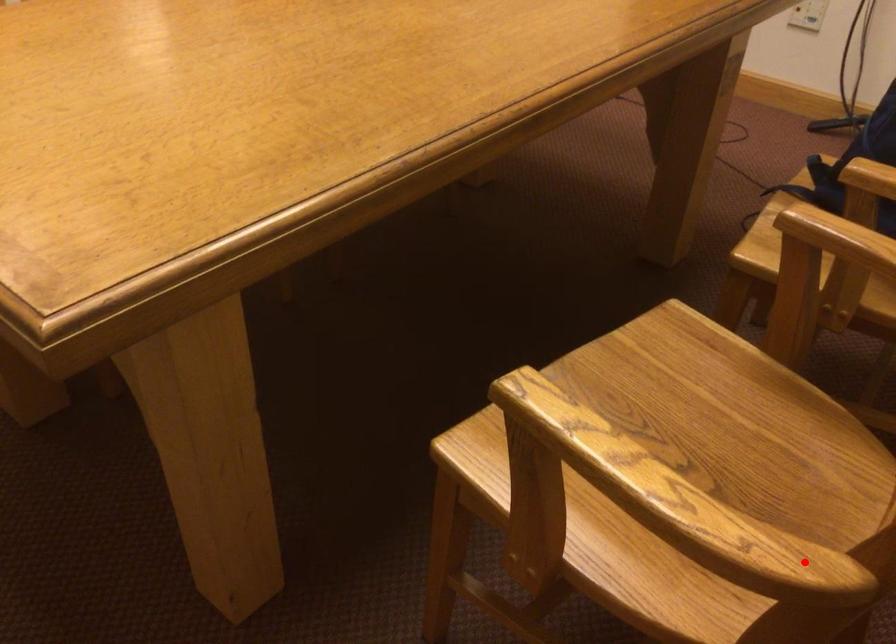
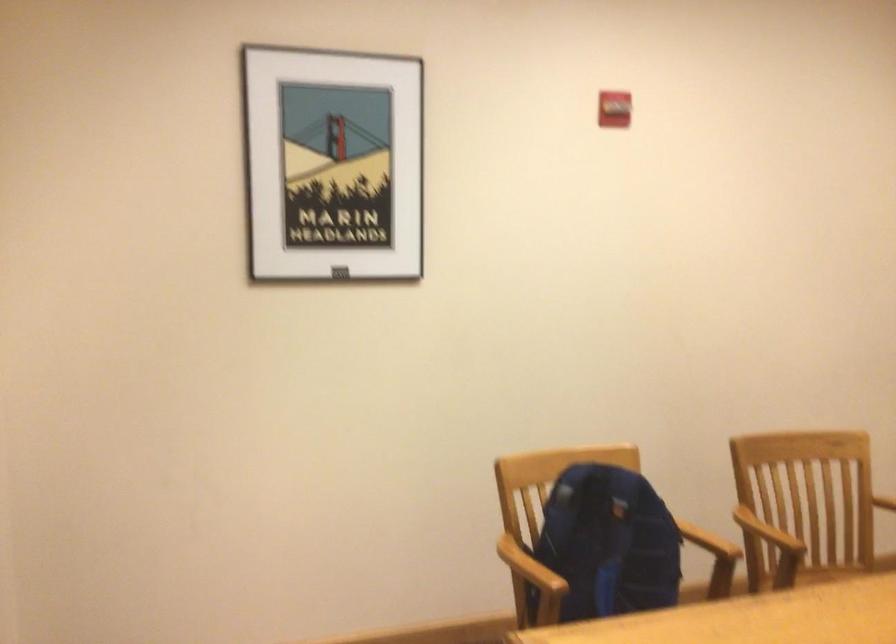
Find the pixel in the second image that matches the highlighted location in the first image.

(837, 572)